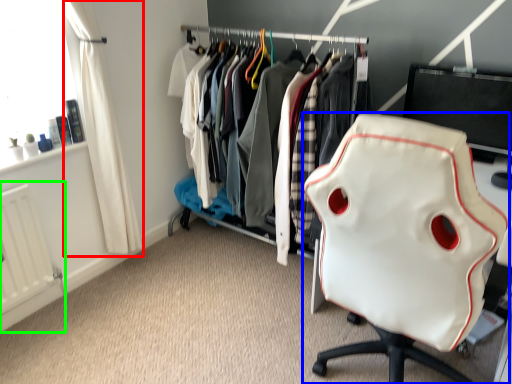
Question: Which is farther away from curtain (highlighted by a red box)? chair (highlighted by a blue box) or radiator (highlighted by a green box)?

Choices:
 (A) chair
 (B) radiator

Answer: (A)